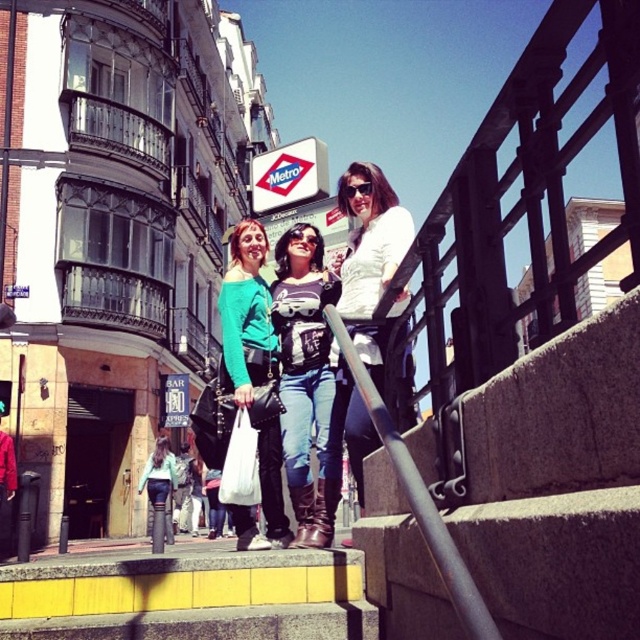
You are a photographer trying to capture a candid shot of the denim jeans at center and the white matte jacket at upper center. Since you want to ensure both are clearly visible in the frame, which object should you focus on first considering their sizes?

The denim jeans at center has a smaller size compared to the white matte jacket at upper center, so you should focus on the denim jeans at center first to ensure its details are sharp before adjusting for the larger jacket.

Based on the coordinates provided, which object from the scene is exactly at point (307, 380)?

The denim jeans at center is located at point (307, 380).

You are a photographer standing at the bottom of the stairs. You want to take a photo that includes both the denim jeans at center and the white matte jacket at upper center. Given that your camera has a maximum focus range of 2 meters, will you be able to capture both subjects in focus?

The denim jeans at center and white matte jacket at upper center are 2.18 meters apart from each other. Since the distance exceeds the camera maximum focus range of 2 meters, you cannot capture both subjects in focus.